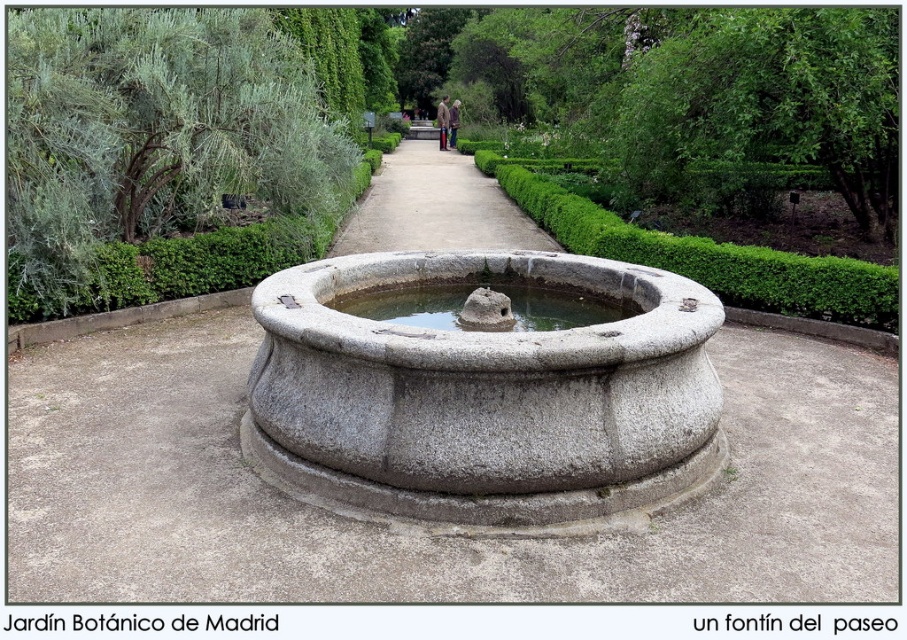
You are standing at the starting point of the garden pathway and want to reach the fountain. There are two points marked as point (194, 166) and point (548, 326). According to the coordinates, which point is closer to your current position?

Point (194, 166) is behind point (548, 326), so the closer point to your current position would be point (548, 326).

You are standing on the paved pathway at Jardn Botnico de Madrid and want to take a photo of the green leafy tree at left and the clear stone water at center. Which object will appear larger in your photo?

The green leafy tree at left will appear larger in the photo because it is taller than the clear stone water at center.